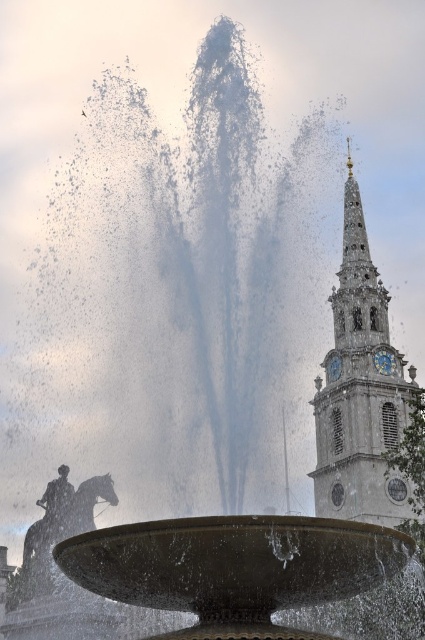
Question: Among these points, which one is nearest to the camera?

Choices:
 (A) (57, 516)
 (B) (385, 419)

Answer: (B)

Question: Does white stone clock tower at right come in front of bronze statue at center?

Choices:
 (A) no
 (B) yes

Answer: (B)

Question: Is the position of white stone clock tower at right less distant than that of bronze statue at center?

Choices:
 (A) yes
 (B) no

Answer: (A)

Question: Among these points, which one is nearest to the camera?

Choices:
 (A) (405, 496)
 (B) (48, 492)

Answer: (A)

Question: Can you confirm if white stone clock tower at right is positioned to the left of bronze statue at center?

Choices:
 (A) no
 (B) yes

Answer: (A)